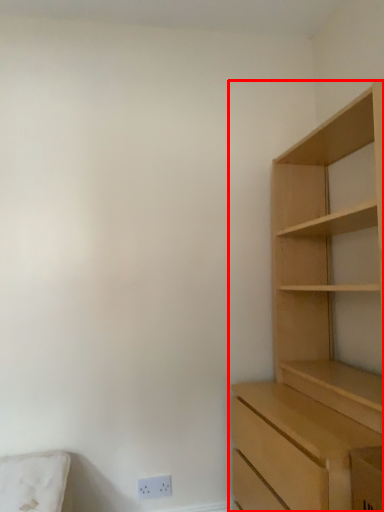
Question: From the image's perspective, what is the correct spatial relationship of cupboard (annotated by the red box) in relation to electric outlet?

Choices:
 (A) above
 (B) below

Answer: (A)